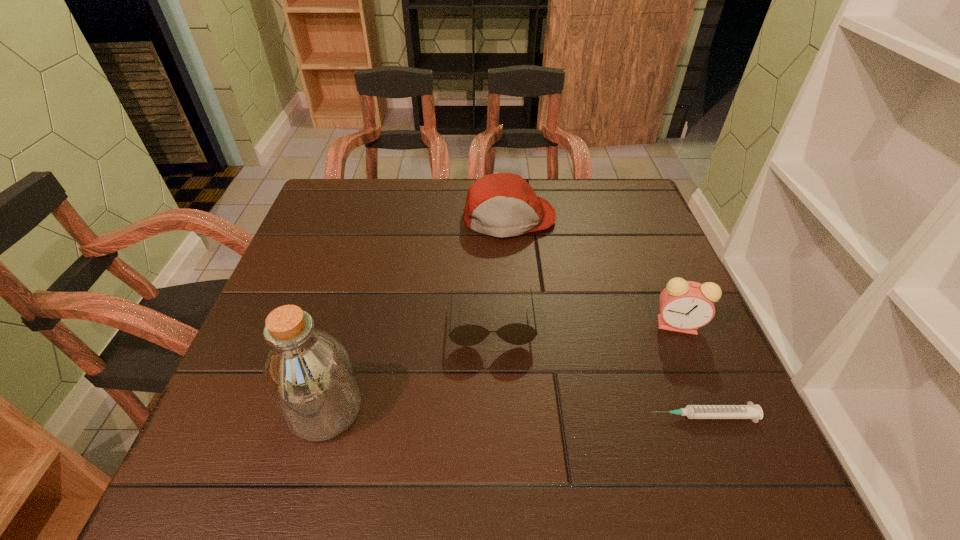
Identify the location of vacant space at the far left corner of the desktop. The image size is (960, 540). (337, 208).

Where is `blank space at the far right corner of the desktop`? The width and height of the screenshot is (960, 540). blank space at the far right corner of the desktop is located at coordinates (613, 178).

You are a GUI agent. You are given a task and a screenshot of the screen. Output one action in this format:
    pyautogui.click(x=<x>, y=<y>)
    Task: Click on the vacant area that lies between the cap and the alarm clock
    
    Given the screenshot: What is the action you would take?
    pyautogui.click(x=593, y=272)

The image size is (960, 540). Identify the location of vacant space that's between the shortest object and the alarm clock. (690, 370).

Where is `vacant region between the alarm clock and the tallest object`? The height and width of the screenshot is (540, 960). vacant region between the alarm clock and the tallest object is located at coordinates (501, 367).

Identify the location of empty location between the syringe and the tallest object. (515, 413).

Identify the location of blank region between the fourth tallest object and the cap. The width and height of the screenshot is (960, 540). (500, 271).

Locate an element on the screen. The width and height of the screenshot is (960, 540). vacant point located between the cap and the bottle is located at coordinates (418, 314).

The width and height of the screenshot is (960, 540). Identify the location of unoccupied position between the leftmost object and the alarm clock. (501, 367).

The image size is (960, 540). I want to click on empty location between the bottle and the alarm clock, so click(501, 367).